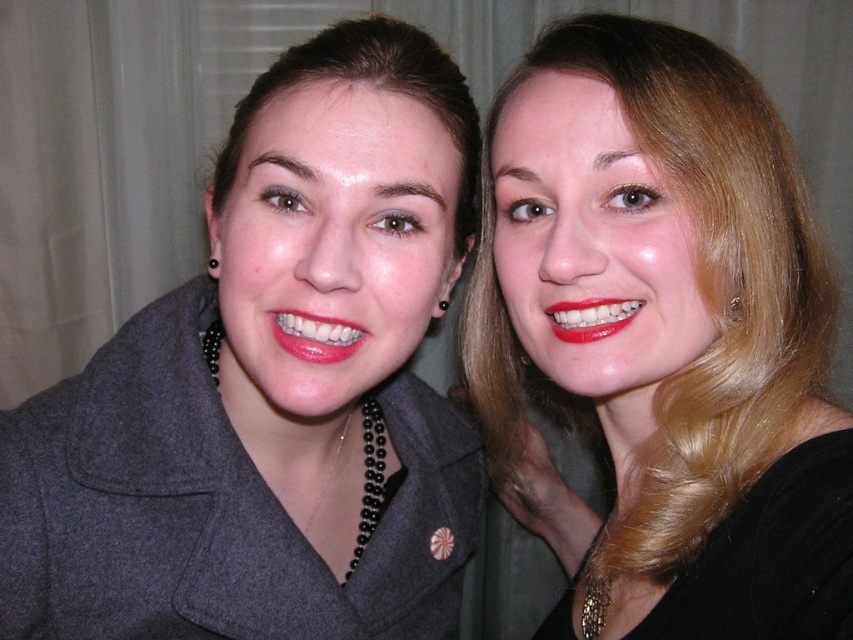
You are a photographer trying to capture a closeup shot of both the matte gray coat at left and the matte red lipstick at right in the image. The camera lens has a maximum focus range of 10 inches. Can you fit both items within the focus range?

The matte gray coat at left and the matte red lipstick at right are 9.19 inches apart from each other. Since the distance between them is less than the camera lens maximum focus range of 10 inches, the photographer can fit both items within the focus range.

You are a photographer setting up a closeup shot of the two people in the scene. You need to ensure that both the blonde hair at upper right and the matte red lipstick at right are clearly visible in the frame. Based on their sizes, which one might require more careful framing to avoid being cut off?

The blonde hair at upper right might be wider than the matte red lipstick at right, so it might require more careful framing to avoid being cut off.

You are standing in front of the two people in the image and want to take a photo of them. Your camera has a minimum focus distance of 60 centimeters. Can you focus on the point at point (111,381) without moving closer?

The point at point (111,381) is 65.57 centimeters away from you, which is beyond the camera minimum focus distance of 60 centimeters. Therefore, you can focus on the point at point (111,381) without moving closer.